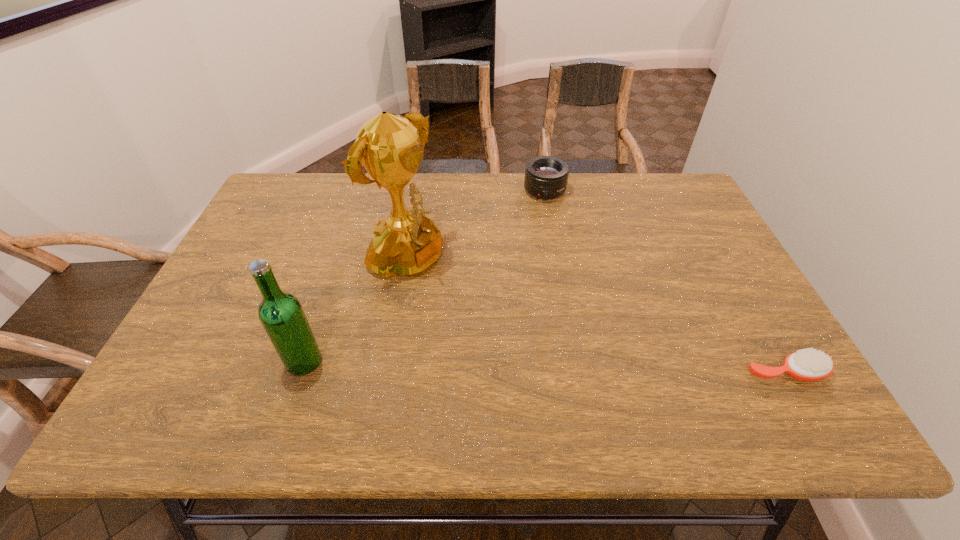
Where is `object that is at the near right corner`? object that is at the near right corner is located at coordinates point(808,364).

I want to click on vacant space at the far edge, so click(x=429, y=174).

The image size is (960, 540). In order to click on free space at the near edge of the desktop in this screenshot , I will do `click(477, 362)`.

Identify the location of free space at the left edge of the desktop. The height and width of the screenshot is (540, 960). (218, 288).

Where is `free space at the right edge of the desktop`? The height and width of the screenshot is (540, 960). free space at the right edge of the desktop is located at coordinates (693, 276).

In the image, there is a desktop. Where is `vacant area at the far left corner`? Image resolution: width=960 pixels, height=540 pixels. vacant area at the far left corner is located at coordinates (289, 179).

Locate an element on the screen. The height and width of the screenshot is (540, 960). vacant space at the far right corner of the desktop is located at coordinates (666, 179).

This screenshot has width=960, height=540. What are the coordinates of `blank space at the near right corner of the desktop` in the screenshot? It's located at (717, 356).

Where is `unoccupied area between the third tallest object and the rightmost object`? Image resolution: width=960 pixels, height=540 pixels. unoccupied area between the third tallest object and the rightmost object is located at coordinates (664, 281).

This screenshot has width=960, height=540. Identify the location of empty space that is in between the beer bottle and the tallest object. (354, 312).